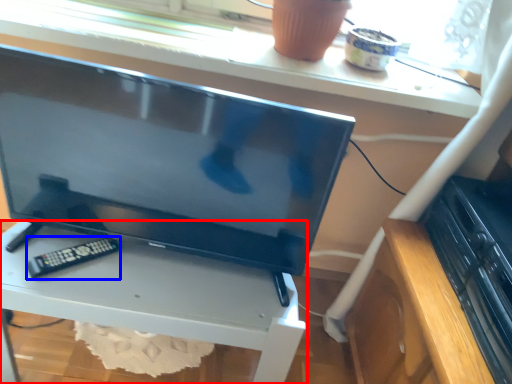
Question: Which of the following is the closest to the observer, furniture (highlighted by a red box) or control (highlighted by a blue box)?

Choices:
 (A) furniture
 (B) control

Answer: (A)